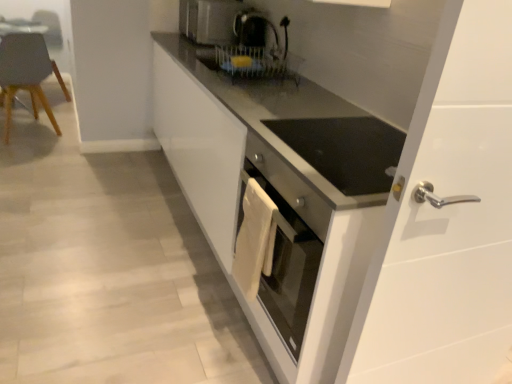
Locate an element on the screen. The height and width of the screenshot is (384, 512). vacant area that lies in front of matte gray chair at left is located at coordinates (24, 155).